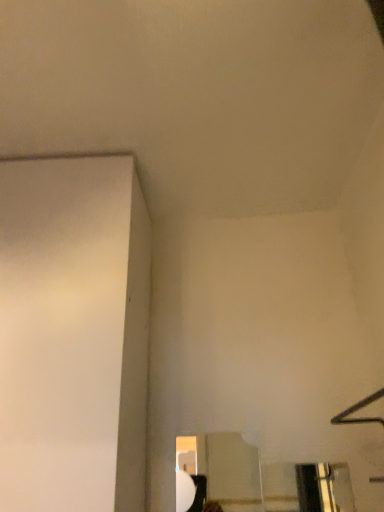
The image size is (384, 512). Describe the element at coordinates (324, 488) in the screenshot. I see `transparent glass window at lower right` at that location.

I want to click on transparent glass window at lower right, so click(x=324, y=488).

The image size is (384, 512). What are the coordinates of `transparent glass window at lower right` in the screenshot? It's located at 324,488.